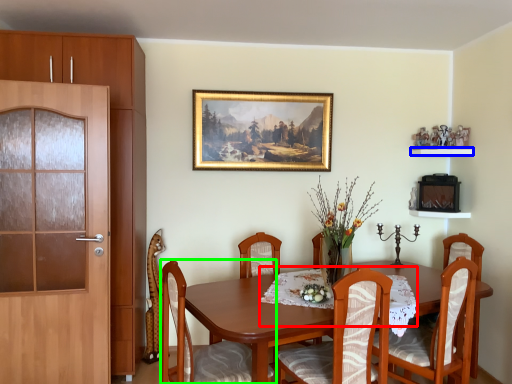
Question: Estimate the real-world distances between objects in this image. Which object is farther from tablecloth (highlighted by a red box), shelf (highlighted by a blue box) or chair (highlighted by a green box)?

Choices:
 (A) shelf
 (B) chair

Answer: (A)